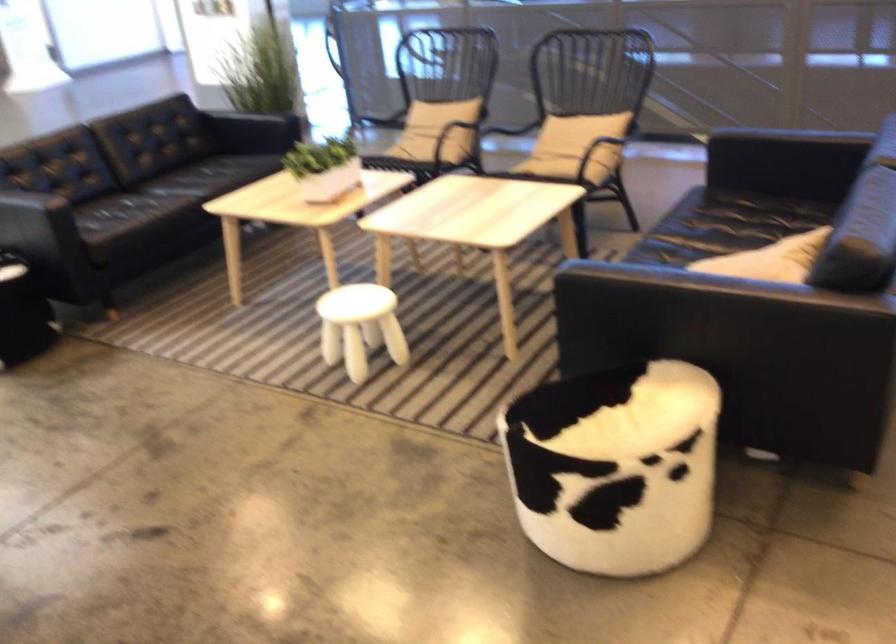
Where would you plac the white throw pillow? Please return your answer as a coordinate pair (x, y).

(770, 259)